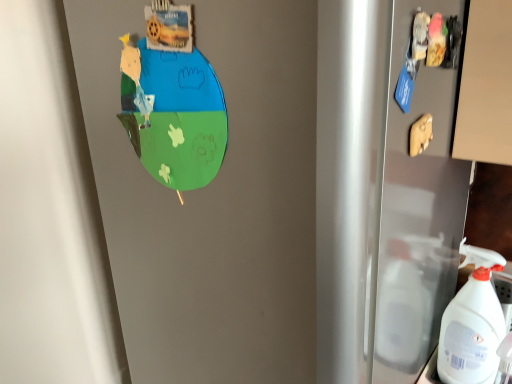
Find the location of a particular element. white plastic spray bottle at lower right is located at coordinates (x=472, y=323).

Describe the element at coordinates (472, 323) in the screenshot. The height and width of the screenshot is (384, 512). I see `white plastic spray bottle at lower right` at that location.

In order to click on white plastic spray bottle at lower right in this screenshot , I will do `click(472, 323)`.